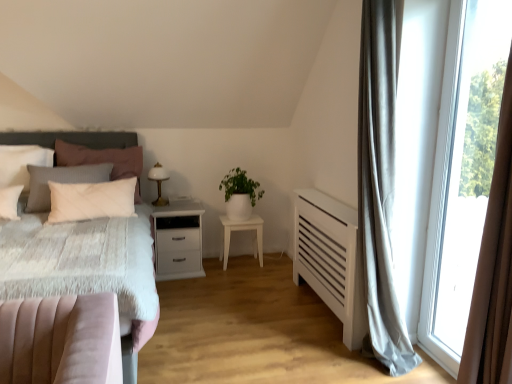
Locate an element on the screen. free space between white matte nightstand at center, which is the first nightstand from left to right, and white matte nightstand at center, the 2th nightstand from the left is located at coordinates (221, 268).